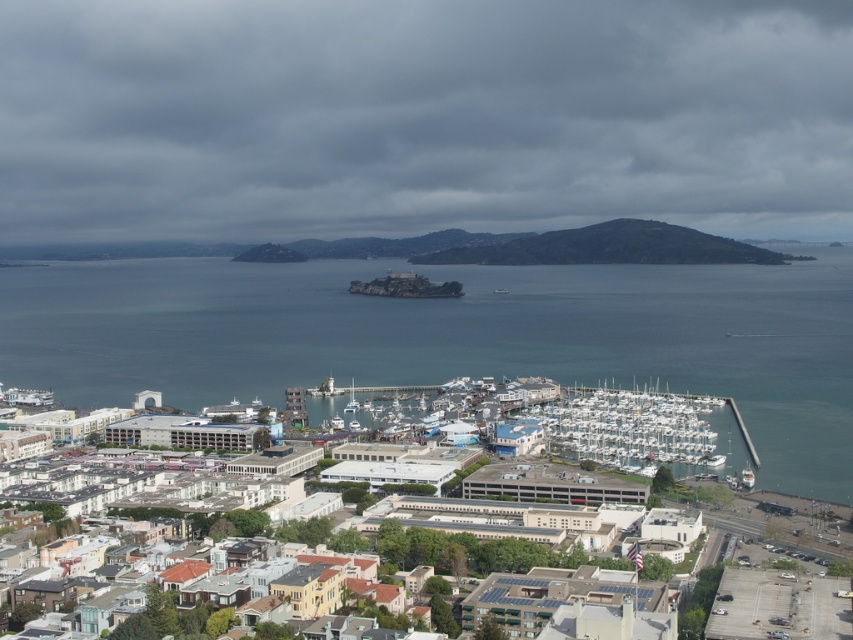
You are a photographer standing at the edge of the marina and want to capture both the clear blue water at center and the white glossy boat at lower right in a single shot. Which object will appear larger in the photo?

The clear blue water at center will appear larger in the photo because it is much taller than the white glossy boat at lower right.

You are a tour guide explaining the marina to visitors. You mention the clear blue water at center and the white glossy boat at lower right. How far apart are these two landmarks?

The clear blue water at center is 143.75 meters away from the white glossy boat at lower right.